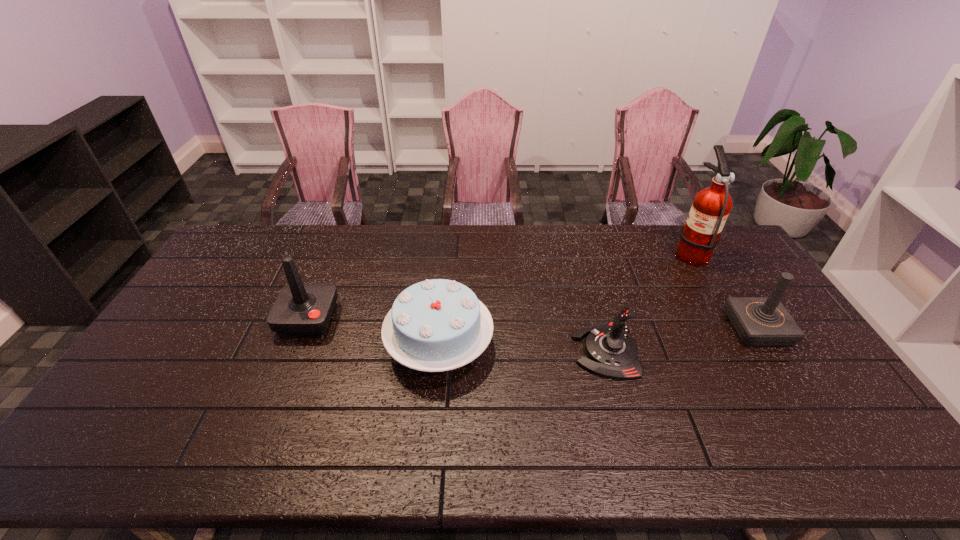
You are a GUI agent. You are given a task and a screenshot of the screen. Output one action in this format:
    pyautogui.click(x=<x>, y=<y>)
    Task: Click on the farthest object
    
    Given the screenshot: What is the action you would take?
    point(701,234)

Where is `the tallest object`? This screenshot has height=540, width=960. the tallest object is located at coordinates (701, 234).

The height and width of the screenshot is (540, 960). I want to click on the leftmost object, so click(x=300, y=309).

At what (x,y) coordinates should I click in order to perform the action: click on the rightmost joystick. Please return your answer as a coordinate pair (x, y). Looking at the image, I should click on (759, 321).

Locate an element on the screen. birthday cake is located at coordinates (436, 325).

What are the coordinates of `the shortest object` in the screenshot? It's located at (612, 353).

At what (x,y) coordinates should I click in order to perform the action: click on the second joystick from right to left. Please return your answer as a coordinate pair (x, y). Looking at the image, I should click on (612, 353).

The image size is (960, 540). In order to click on vacant position located on the nozzle and handle of the fire extinguisher in this screenshot , I will do `click(587, 252)`.

Image resolution: width=960 pixels, height=540 pixels. In order to click on vacant space located 0.350m on the nozzle and handle of the fire extinguisher in this screenshot , I will do pos(576,252).

The width and height of the screenshot is (960, 540). I want to click on vacant space located on the nozzle and handle of the fire extinguisher, so click(616, 252).